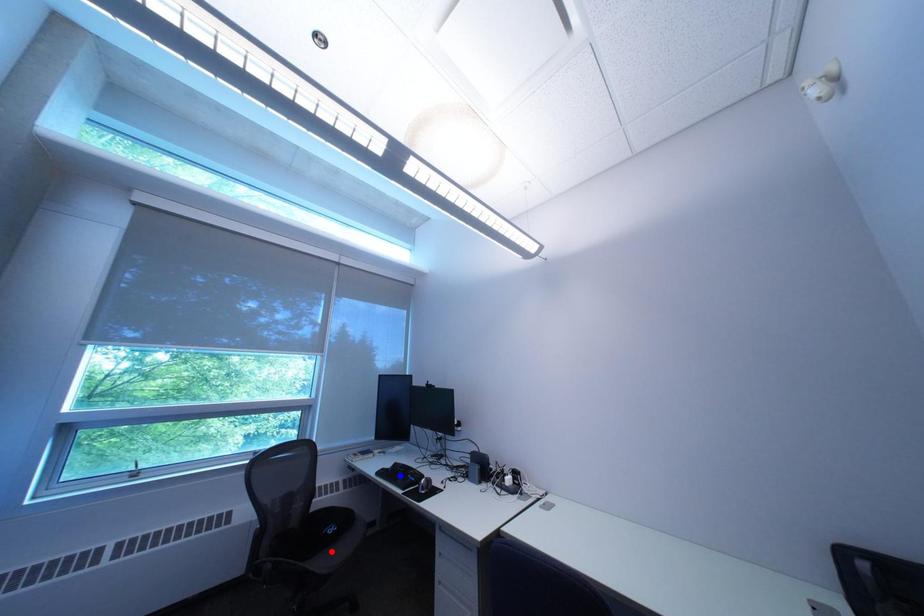
Question: Which of the two points in the image is closer to the camera?

Choices:
 (A) Blue point is closer.
 (B) Red point is closer.

Answer: (B)